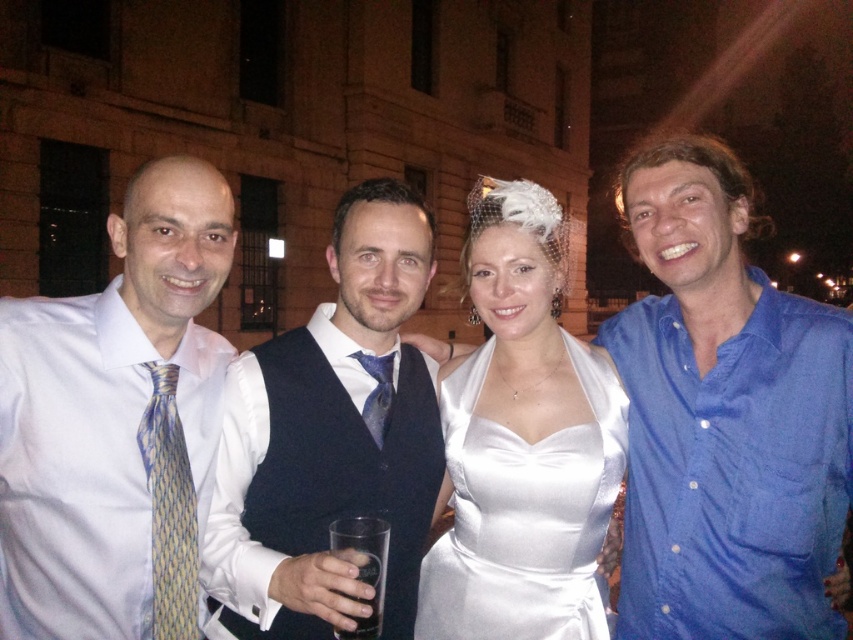
Between point (567, 624) and point (378, 433), which one is positioned in front?

Point (567, 624) is more forward.

Is satin white dress at center closer to camera compared to blue satin tie at center?

Yes, satin white dress at center is in front of blue satin tie at center.

At what (x,y) coordinates should I click in order to perform the action: click on satin white dress at center. Please return your answer as a coordinate pair (x, y). Image resolution: width=853 pixels, height=640 pixels. Looking at the image, I should click on (524, 513).

Where is `satin white dress at center`? The width and height of the screenshot is (853, 640). satin white dress at center is located at coordinates (524, 513).

Identify the location of satin white dress at center. (524, 513).

Between satin white dress at center and clear glass at center, which one is positioned lower?

clear glass at center is below.

Between point (480, 465) and point (364, 600), which one is positioned behind?

The point (480, 465) is more distant.

Locate an element on the screen. satin white dress at center is located at coordinates (524, 513).

Is blue cotton shirt at right thinner than satin white dress at center?

No.

Find the location of a particular element. This screenshot has height=640, width=853. blue cotton shirt at right is located at coordinates (724, 419).

Where is `blue cotton shirt at right`? Image resolution: width=853 pixels, height=640 pixels. blue cotton shirt at right is located at coordinates (724, 419).